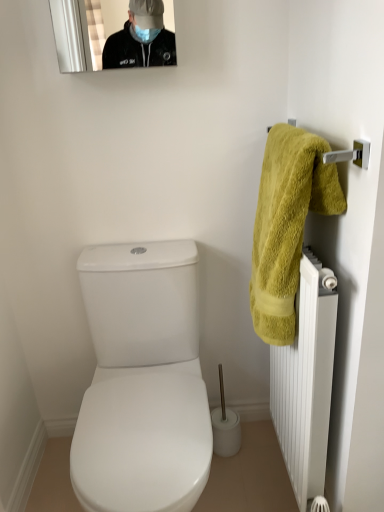
Question: Considering the relative positions of white matte radiator at right and yellow fluffy towel at right in the image provided, is white matte radiator at right to the left or to the right of yellow fluffy towel at right?

Choices:
 (A) left
 (B) right

Answer: (B)

Question: In terms of size, does white matte radiator at right appear bigger or smaller than yellow fluffy towel at right?

Choices:
 (A) big
 (B) small

Answer: (A)

Question: Estimate the real-world distances between objects in this image. Which object is closer to the yellow fluffy towel at right?

Choices:
 (A) white plastic toilet brush at center
 (B) white matte radiator at right

Answer: (B)

Question: Which of these objects is positioned farthest from the white plastic toilet brush at center?

Choices:
 (A) yellow fluffy towel at right
 (B) white matte radiator at right

Answer: (A)